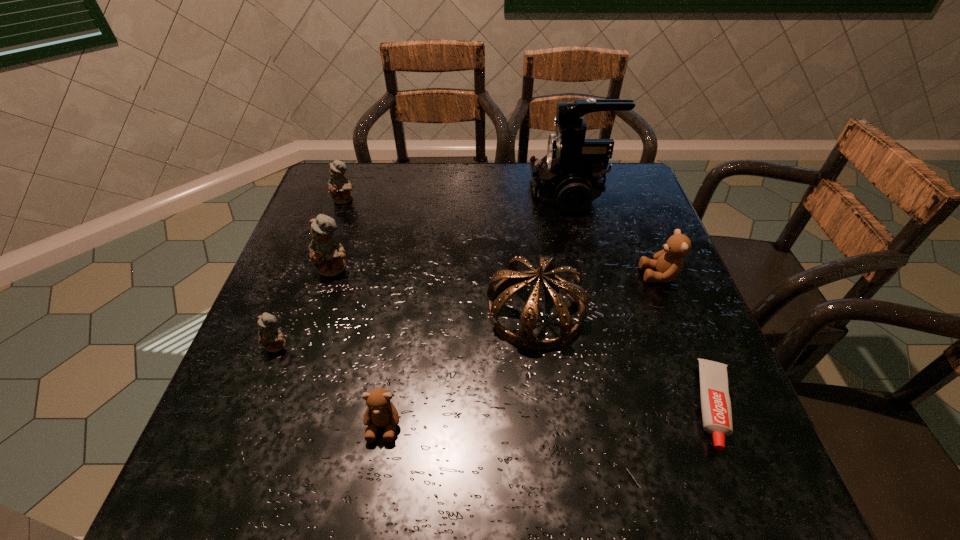
Identify which object is the sixth closest to the brown tiara. Please provide its 2D coordinates. Your answer should be formatted as a tuple, i.e. [(x, y)], where the tuple contains the x and y coordinates of a point satisfying the conditions above.

[(271, 338)]

The height and width of the screenshot is (540, 960). Identify the location of teddy bear that can be found as the second closest to the nearest blue teddy bear. (381, 412).

Locate which teddy bear is the fourth closest to the biggest blue teddy bear. Please provide its 2D coordinates. Your answer should be formatted as a tuple, i.e. [(x, y)], where the tuple contains the x and y coordinates of a point satisfying the conditions above.

[(668, 263)]

Select which blue teddy bear appears as the second closest to the shortest object. Please provide its 2D coordinates. Your answer should be formatted as a tuple, i.e. [(x, y)], where the tuple contains the x and y coordinates of a point satisfying the conditions above.

[(271, 338)]

The height and width of the screenshot is (540, 960). In order to click on blue teddy bear that is the nearest to the toothpaste in this screenshot , I will do `click(326, 254)`.

I want to click on free space that satisfies the following two spatial constraints: 1. on the lens mount of the shortest object; 2. on the right side of the tallest object, so click(x=622, y=406).

The width and height of the screenshot is (960, 540). Identify the location of free space that satisfies the following two spatial constraints: 1. on the lens mount of the tallest object; 2. on the front-facing side of the smallest blue teddy bear. (608, 346).

Find the location of `vacant space that satisfies the following two spatial constraints: 1. on the front-facing side of the right brown teddy bear; 2. on the front-facing side of the smaller brown teddy bear`. vacant space that satisfies the following two spatial constraints: 1. on the front-facing side of the right brown teddy bear; 2. on the front-facing side of the smaller brown teddy bear is located at coordinates (719, 426).

Identify the location of free space that satisfies the following two spatial constraints: 1. on the back side of the shortest object; 2. on the lens mount of the tallest object. click(x=630, y=193).